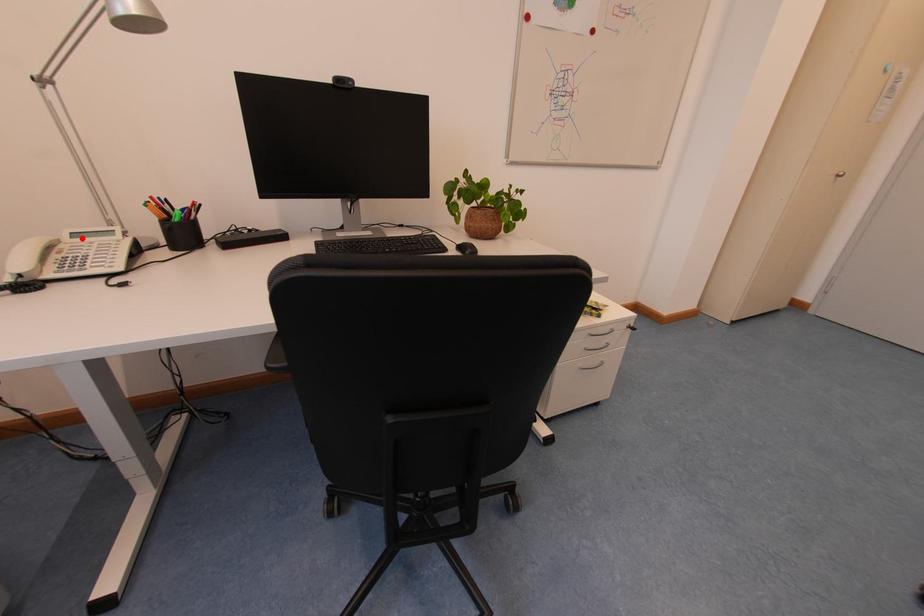
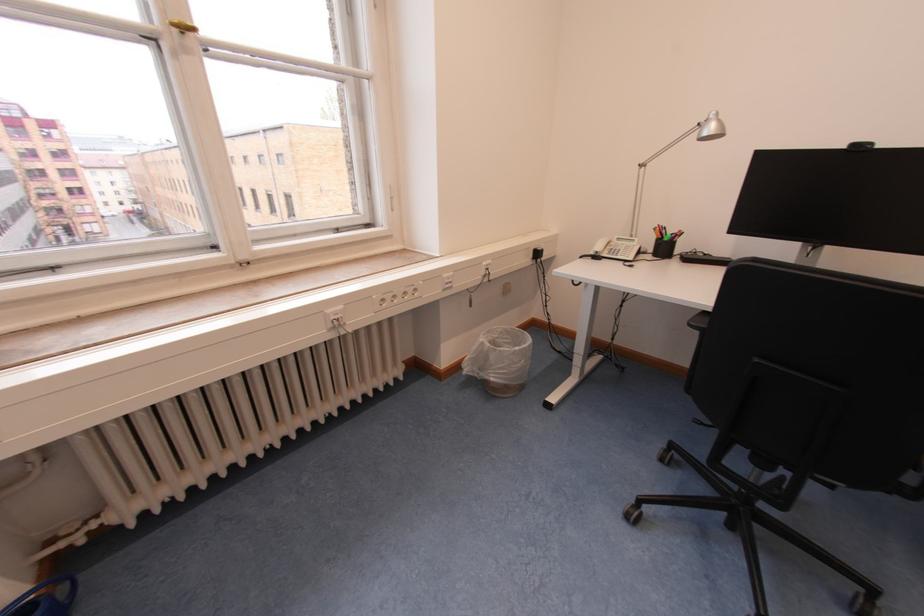
Where in the second image is the point corresponding to the highlighted location from the first image?

(625, 241)